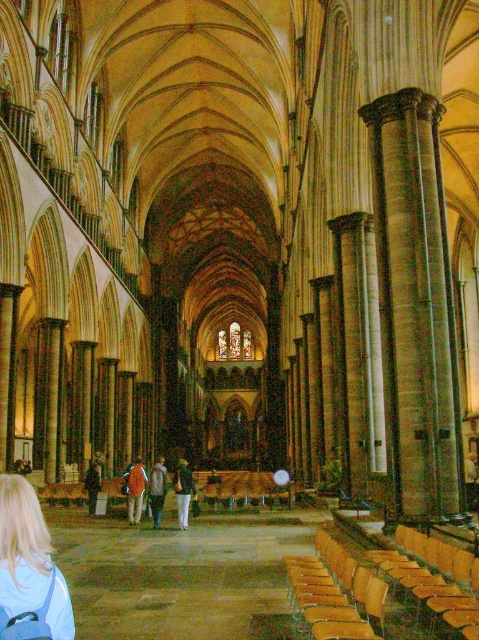
Does orange fabric pants at center appear on the left side of denim jacket at center?

Yes, orange fabric pants at center is to the left of denim jacket at center.

Is point (128, 497) in front of point (162, 504)?

No, (128, 497) is behind (162, 504).

At what (x,y) coordinates should I click in order to perform the action: click on orange fabric pants at center. Please return your answer as a coordinate pair (x, y). The width and height of the screenshot is (479, 640). Looking at the image, I should click on (136, 490).

Can you confirm if green textured shirt at center is wider than denim jacket at center?

No, green textured shirt at center is not wider than denim jacket at center.

Which of these two, green textured shirt at center or denim jacket at center, stands taller?

green textured shirt at center is taller.

Is point (184, 516) in front of point (159, 516)?

That is True.

This screenshot has width=479, height=640. What are the coordinates of `green textured shirt at center` in the screenshot? It's located at [x=183, y=492].

Is blonde hair at lower left above dark brown leather jacket at lower left?

Yes, blonde hair at lower left is above dark brown leather jacket at lower left.

Is point (54, 621) positioned behind point (90, 476)?

No, it is in front of (90, 476).

At what (x,y) coordinates should I click in order to perform the action: click on blonde hair at lower left. Please return your answer as a coordinate pair (x, y). Image resolution: width=479 pixels, height=640 pixels. Looking at the image, I should click on (29, 570).